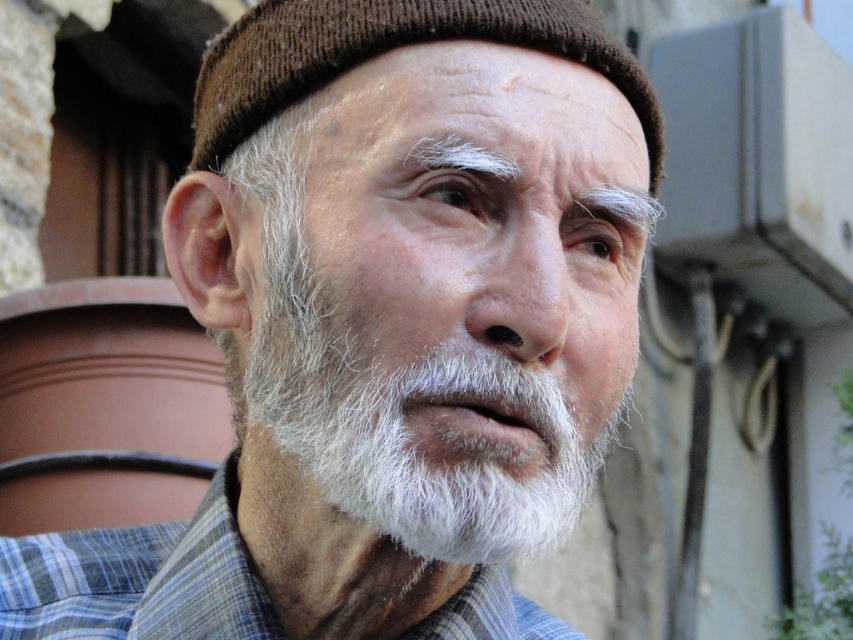
Question: Which point is closer to the camera?

Choices:
 (A) (347, 452)
 (B) (251, 83)

Answer: (A)

Question: Is blue plaid shirt at center bigger than brown knitted hat at upper center?

Choices:
 (A) yes
 (B) no

Answer: (B)

Question: Which point is farther from the camera taking this photo?

Choices:
 (A) (492, 506)
 (B) (49, 536)

Answer: (B)

Question: Which object is the farthest from the white matte beard at center?

Choices:
 (A) brown knitted hat at upper center
 (B) blue plaid shirt at center

Answer: (B)

Question: Can you confirm if white matte beard at center is bigger than blue plaid shirt at center?

Choices:
 (A) yes
 (B) no

Answer: (A)

Question: Can you confirm if white matte beard at center is bigger than brown knitted hat at upper center?

Choices:
 (A) yes
 (B) no

Answer: (A)